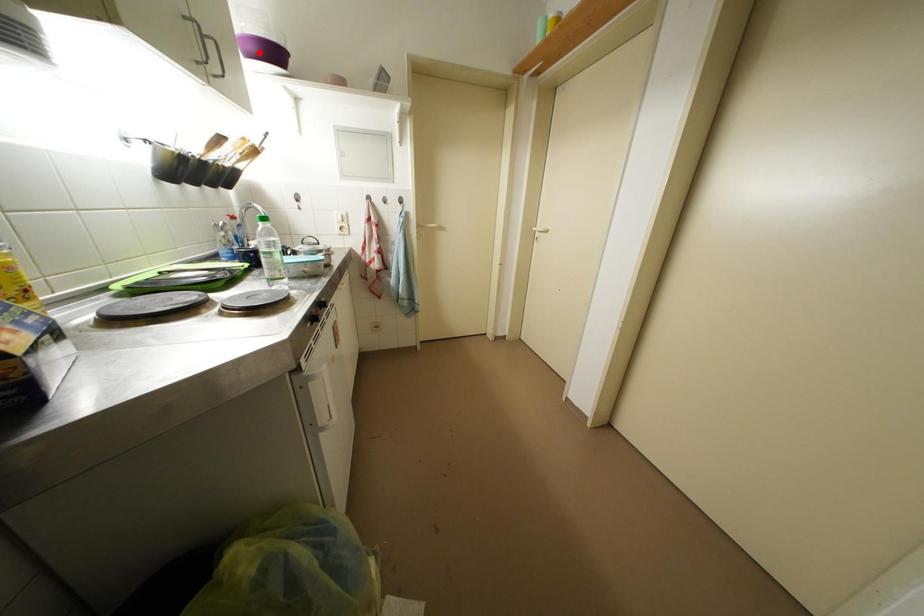
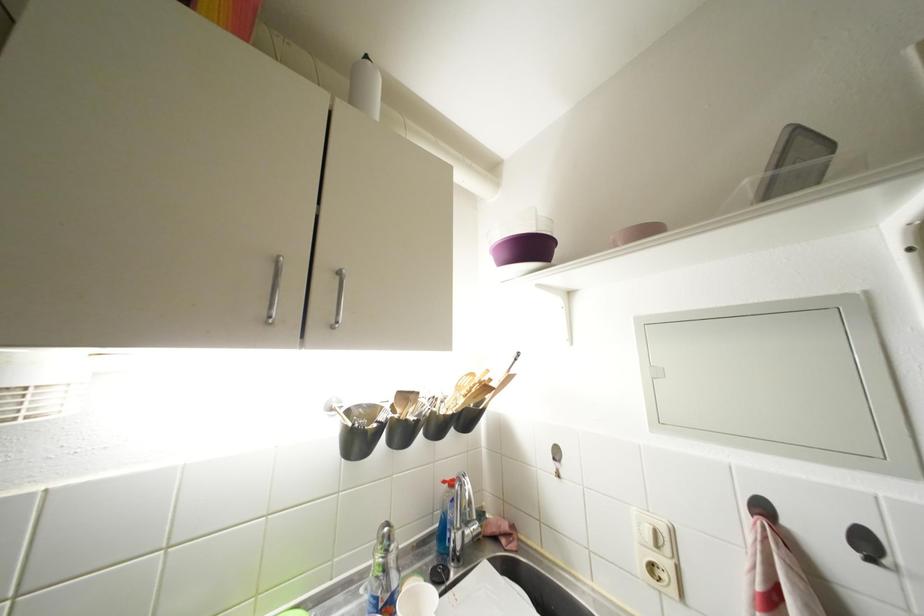
Locate, in the second image, the point that corresponds to the highlighted location in the first image.

(512, 259)